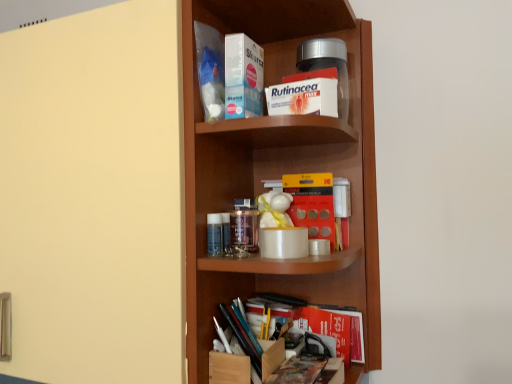
Image resolution: width=512 pixels, height=384 pixels. I want to click on vacant region above wooden shelf at center (from a real-world perspective), so coord(285,15).